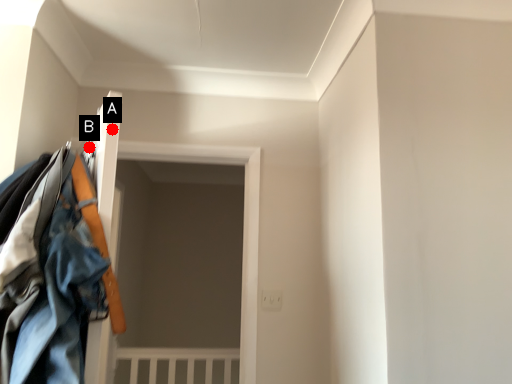
Question: Two points are circled on the image, labeled by A and B beside each circle. Among these points, which one is farthest from the camera?

Choices:
 (A) A is further
 (B) B is further

Answer: (B)